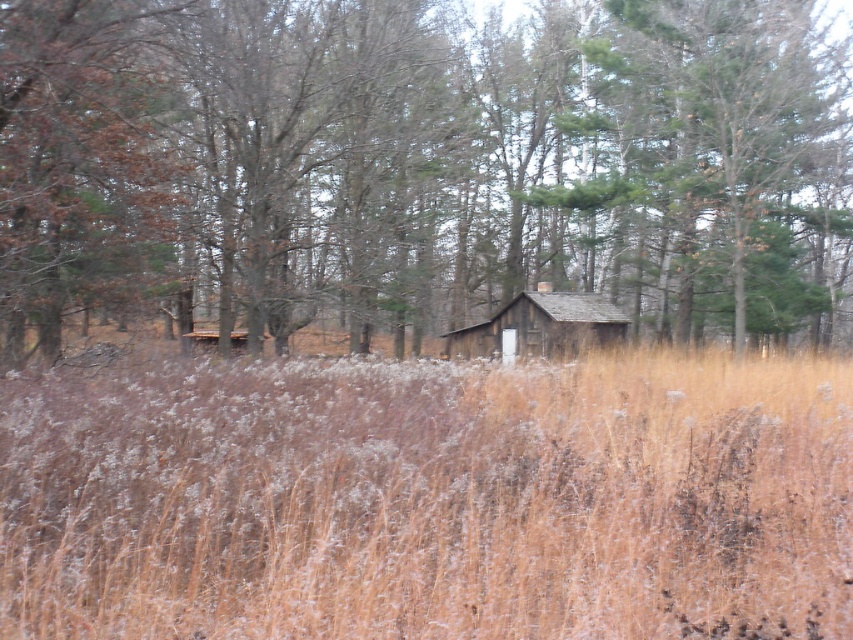
Who is more forward, [287,189] or [554,312]?

Point [287,189] is more forward.

Which of these two, brown wood tree at center or wooden cabin at center, stands shorter?

wooden cabin at center

Does point (675, 248) come behind point (469, 324)?

No, it is not.

Image resolution: width=853 pixels, height=640 pixels. What are the coordinates of `brown wood tree at center` in the screenshot? It's located at (422, 164).

Can you confirm if brown dry grass at center is positioned below wooden cabin at center?

Yes, brown dry grass at center is below wooden cabin at center.

Locate an element on the screen. brown dry grass at center is located at coordinates 430,500.

How far apart are brown wood tree at center and brown dry grass at center?

They are 11.71 meters apart.

What do you see at coordinates (422, 164) in the screenshot?
I see `brown wood tree at center` at bounding box center [422, 164].

This screenshot has height=640, width=853. Find the location of `brown wood tree at center`. brown wood tree at center is located at coordinates (422, 164).